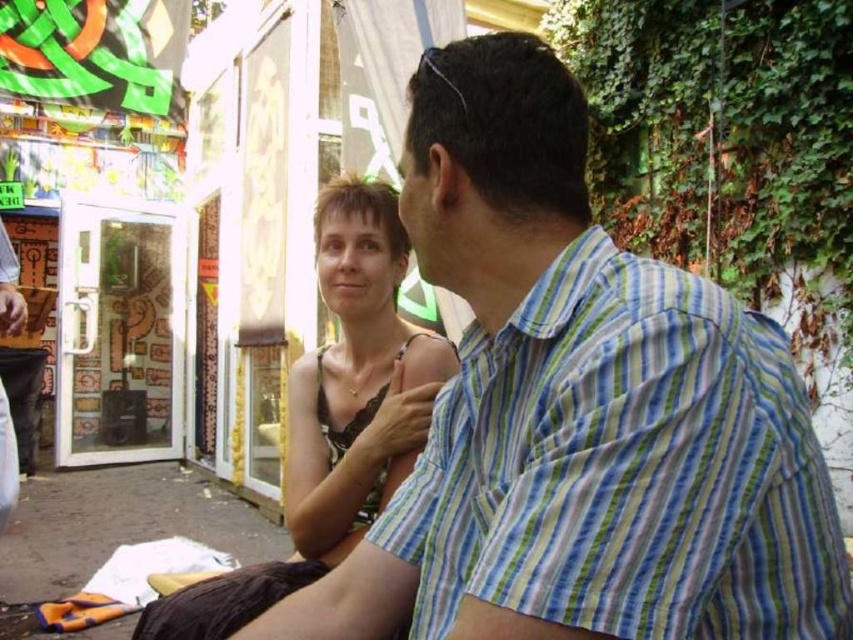
Is point (738, 570) more distant than point (375, 433)?

No, (738, 570) is in front of (375, 433).

Does striped cotton shirt at upper right have a lesser height compared to matte black dress at center?

Indeed, striped cotton shirt at upper right has a lesser height compared to matte black dress at center.

Between point (640, 508) and point (289, 372), which one is positioned behind?

The point (289, 372) is more distant.

You are a GUI agent. You are given a task and a screenshot of the screen. Output one action in this format:
    pyautogui.click(x=<x>, y=<y>)
    Task: Click on the striped cotton shirt at upper right
    The height and width of the screenshot is (640, 853).
    Given the screenshot: What is the action you would take?
    pyautogui.click(x=625, y=467)

The height and width of the screenshot is (640, 853). Describe the element at coordinates (625, 467) in the screenshot. I see `striped cotton shirt at upper right` at that location.

Is point (496, 548) positioned after point (178, 611)?

No, it is not.

You are a GUI agent. You are given a task and a screenshot of the screen. Output one action in this format:
    pyautogui.click(x=<x>, y=<y>)
    Task: Click on the striped cotton shirt at upper right
    The width and height of the screenshot is (853, 640).
    Given the screenshot: What is the action you would take?
    pyautogui.click(x=625, y=467)

Can you confirm if black lace dress at center is thinner than matte black dress at center?

Incorrect, black lace dress at center's width is not less than matte black dress at center's.

Is black lace dress at center smaller than matte black dress at center?

Actually, black lace dress at center might be larger than matte black dress at center.

This screenshot has width=853, height=640. What are the coordinates of `black lace dress at center` in the screenshot? It's located at (334, 417).

You are a GUI agent. You are given a task and a screenshot of the screen. Output one action in this format:
    pyautogui.click(x=<x>, y=<y>)
    Task: Click on the black lace dress at center
    
    Given the screenshot: What is the action you would take?
    pyautogui.click(x=334, y=417)